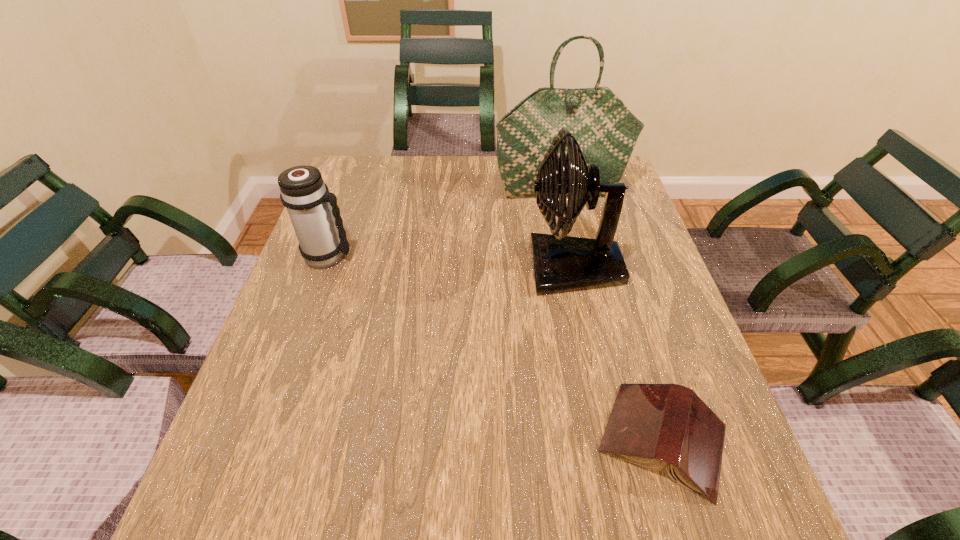
The image size is (960, 540). In order to click on free location that satisfies the following two spatial constraints: 1. in front of the third shortest object to blow air; 2. on the back side of the book in this screenshot , I will do `click(611, 439)`.

The width and height of the screenshot is (960, 540). Identify the location of free spot that satisfies the following two spatial constraints: 1. on the side with the handle of the thermos bottle; 2. on the back side of the shortest object. (263, 439).